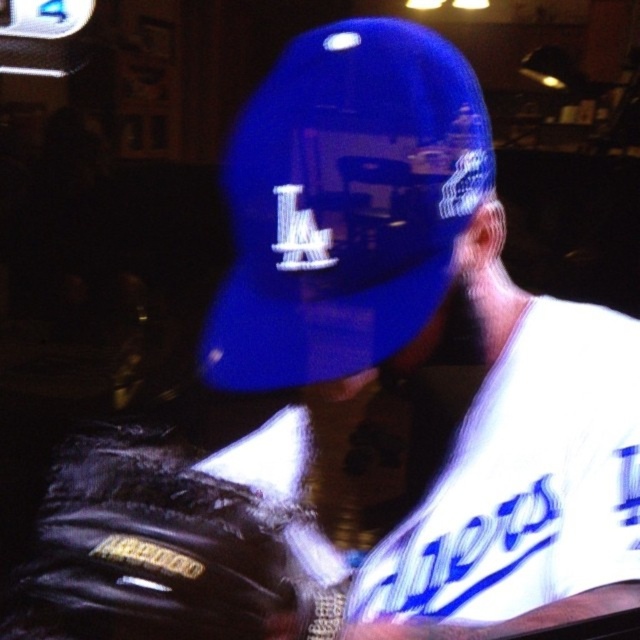
Question: Does glossy blue baseball cap at center appear on the right side of black leather baseball glove at lower left?

Choices:
 (A) yes
 (B) no

Answer: (A)

Question: Among these points, which one is farthest from the camera?

Choices:
 (A) (307, 160)
 (B) (465, 532)

Answer: (B)

Question: Which object appears closest to the camera in this image?

Choices:
 (A) white matte jersey at center
 (B) glossy blue baseball cap at center

Answer: (A)

Question: Is the position of white matte jersey at center more distant than that of black leather baseball glove at lower left?

Choices:
 (A) yes
 (B) no

Answer: (A)

Question: Which point is closer to the camera taking this photo?

Choices:
 (A) (305, 152)
 (B) (44, 531)
 (C) (632, 568)

Answer: (B)

Question: Is glossy blue baseball cap at center to the right of white matte jersey at center from the viewer's perspective?

Choices:
 (A) yes
 (B) no

Answer: (B)